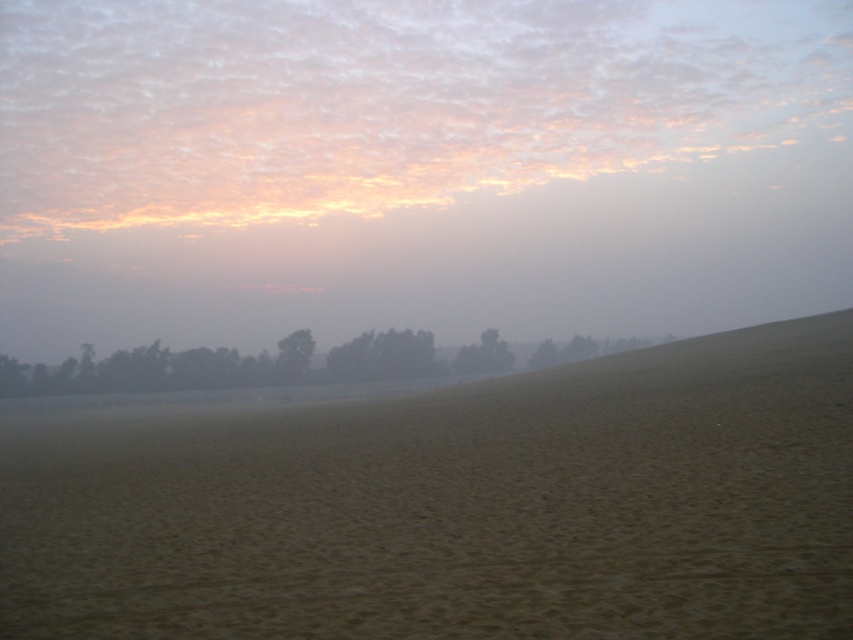
Question: Is foggy sand at lower center positioned in front of brown sandy dirt field at center?

Choices:
 (A) no
 (B) yes

Answer: (A)

Question: Is brown sandy dirt field at center bigger than green matte tree at center?

Choices:
 (A) no
 (B) yes

Answer: (B)

Question: Estimate the real-world distances between objects in this image. Which object is farther from the brown sandy dirt field at center?

Choices:
 (A) foggy sand at lower center
 (B) green matte tree at center
 (C) dark green trees at lower center

Answer: (A)

Question: Which point appears farthest from the camera in this image?

Choices:
 (A) (39, 608)
 (B) (282, 358)
 (C) (292, 52)

Answer: (C)

Question: Which is farther from the brown sandy dirt field at center?

Choices:
 (A) dark green trees at lower center
 (B) green matte tree at center

Answer: (B)

Question: Is foggy sand at lower center to the left of dark green trees at lower center from the viewer's perspective?

Choices:
 (A) yes
 (B) no

Answer: (B)